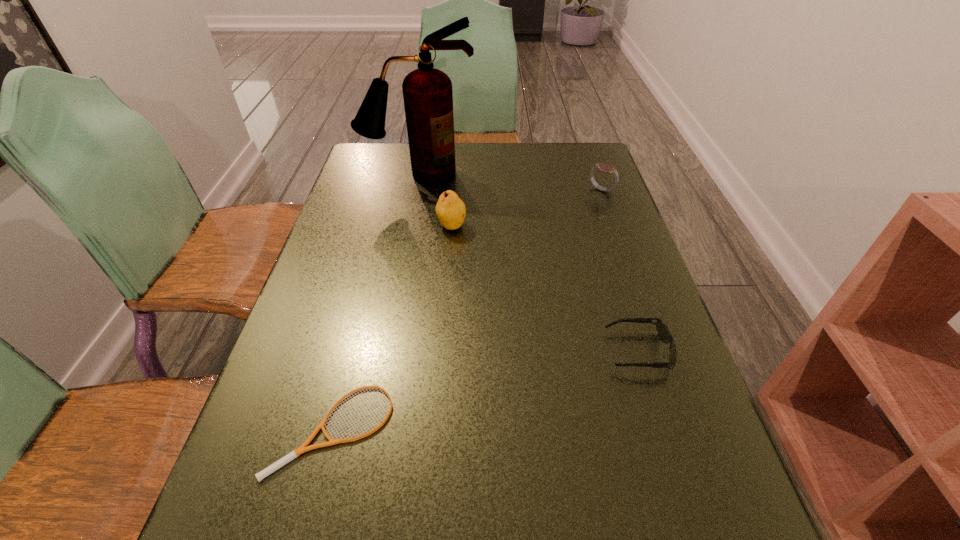
The image size is (960, 540). In order to click on the tallest object in this screenshot , I will do `click(427, 92)`.

Image resolution: width=960 pixels, height=540 pixels. I want to click on pear, so click(450, 209).

Locate an element on the screen. the second tallest object is located at coordinates (450, 209).

Locate an element on the screen. the third shortest object is located at coordinates (604, 167).

You are a GUI agent. You are given a task and a screenshot of the screen. Output one action in this format:
    pyautogui.click(x=<x>, y=<y>)
    Task: Click on the sunglasses
    
    Given the screenshot: What is the action you would take?
    pyautogui.click(x=663, y=332)

This screenshot has height=540, width=960. Identify the location of the second nearest object. (663, 332).

Identify the location of tennis racket. The image size is (960, 540). (292, 455).

The width and height of the screenshot is (960, 540). Identify the location of the nearest object. (292, 455).

Where is `free location located at the nozzle of the tallest object`? The height and width of the screenshot is (540, 960). free location located at the nozzle of the tallest object is located at coordinates (405, 242).

The width and height of the screenshot is (960, 540). I want to click on vacant point located 0.210m on the left of the third farthest object, so click(x=358, y=226).